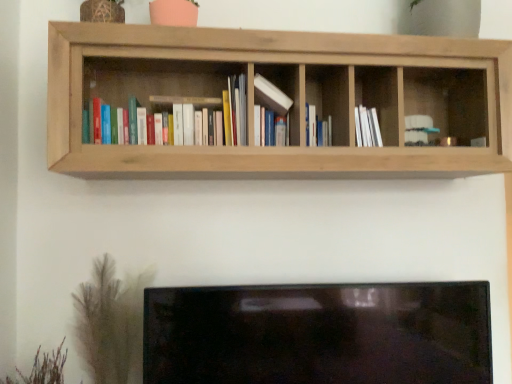
Question: Is white paper at center oriented away from natural wood shelf at upper center?

Choices:
 (A) no
 (B) yes

Answer: (B)

Question: Is white paper at center positioned behind natural wood shelf at upper center?

Choices:
 (A) yes
 (B) no

Answer: (A)

Question: Can you confirm if white paper at center is smaller than natural wood shelf at upper center?

Choices:
 (A) yes
 (B) no

Answer: (A)

Question: Is white paper at center positioned in front of natural wood shelf at upper center?

Choices:
 (A) no
 (B) yes

Answer: (A)

Question: Does white paper at center appear on the right side of natural wood shelf at upper center?

Choices:
 (A) no
 (B) yes

Answer: (B)

Question: From a real-world perspective, is matte hardcover books at left, placed as the 3th book when sorted from right to left, positioned above or below white paper at center?

Choices:
 (A) below
 (B) above

Answer: (B)

Question: In terms of width, does matte hardcover books at left, marked as the 1th book in a left-to-right arrangement, look wider or thinner when compared to white paper at center?

Choices:
 (A) thin
 (B) wide

Answer: (A)

Question: Is matte hardcover books at left, placed as the 3th book when sorted from right to left, bigger or smaller than white paper at center?

Choices:
 (A) big
 (B) small

Answer: (A)

Question: Is matte hardcover books at left, marked as the 1th book in a left-to-right arrangement, taller or shorter than white paper at center?

Choices:
 (A) short
 (B) tall

Answer: (B)

Question: Based on their sizes in the image, would you say brown textured plant at lower left, the first plant from the right, is bigger or smaller than white paper at center?

Choices:
 (A) small
 (B) big

Answer: (B)

Question: Does point (138, 317) appear closer or farther from the camera than point (382, 140)?

Choices:
 (A) farther
 (B) closer

Answer: (A)

Question: From the image's perspective, is brown textured plant at lower left, the first plant from the right, above or below white paper at center?

Choices:
 (A) above
 (B) below

Answer: (B)

Question: Is brown textured plant at lower left, which is the second plant from left to right, wider or thinner than white paper at center?

Choices:
 (A) thin
 (B) wide

Answer: (A)

Question: In the image, is white paper book at center, acting as the 3th book starting from the left, on the left side or the right side of green grass at lower left, the second plant when ordered from right to left?

Choices:
 (A) left
 (B) right

Answer: (B)

Question: From the image's perspective, relative to green grass at lower left, which ranks as the first plant in left-to-right order, is white paper book at center, placed as the 1th book when sorted from right to left, above or below?

Choices:
 (A) above
 (B) below

Answer: (A)